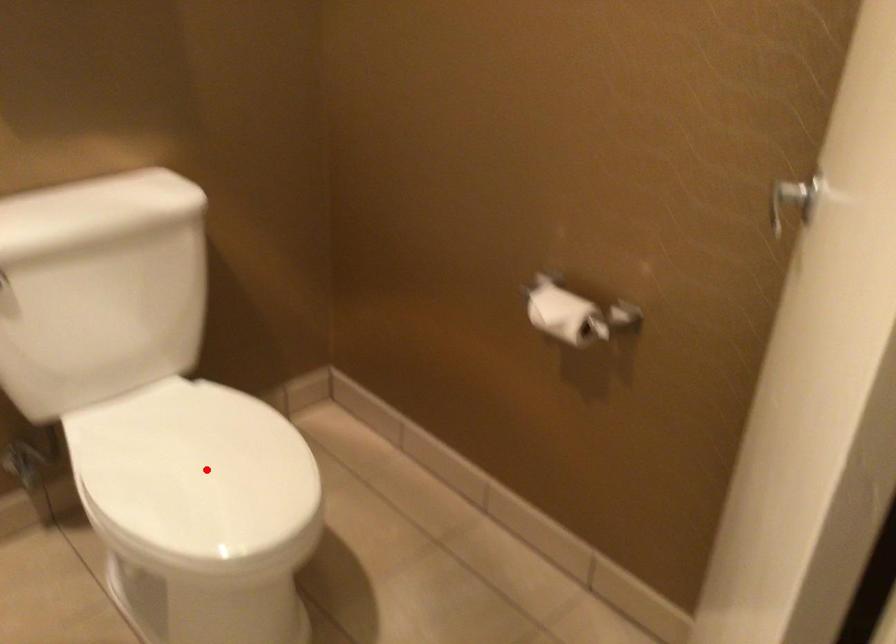
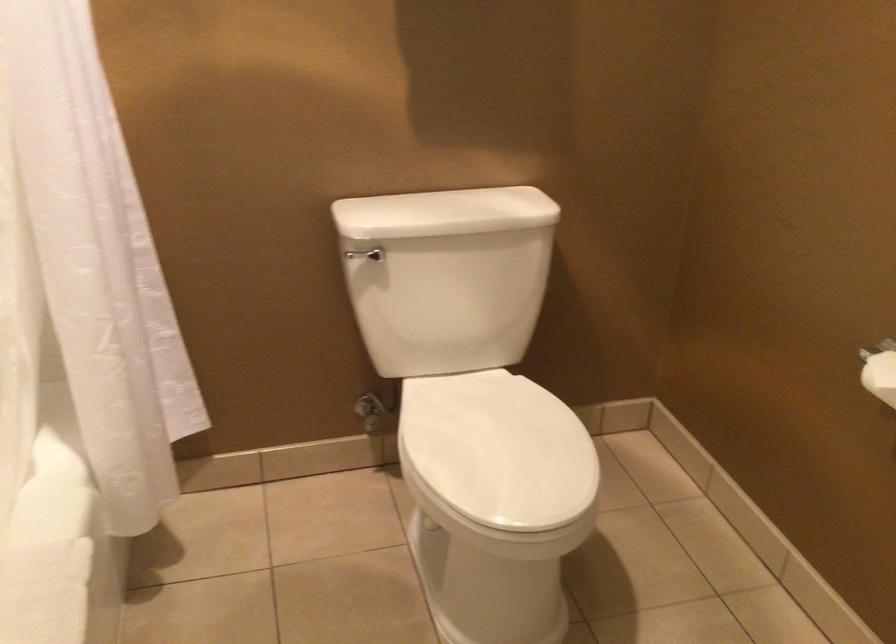
Find the pixel in the second image that matches the highlighted location in the first image.

(498, 450)